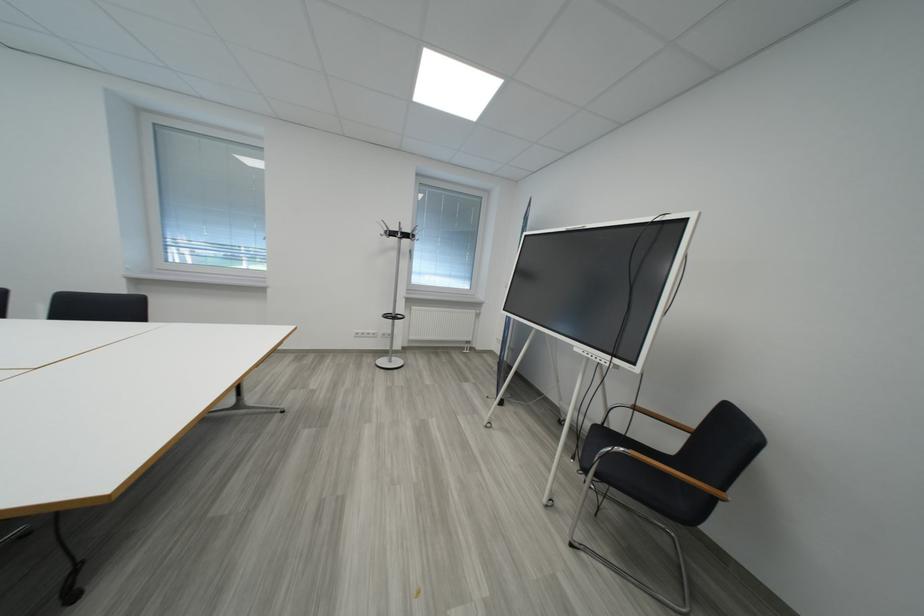
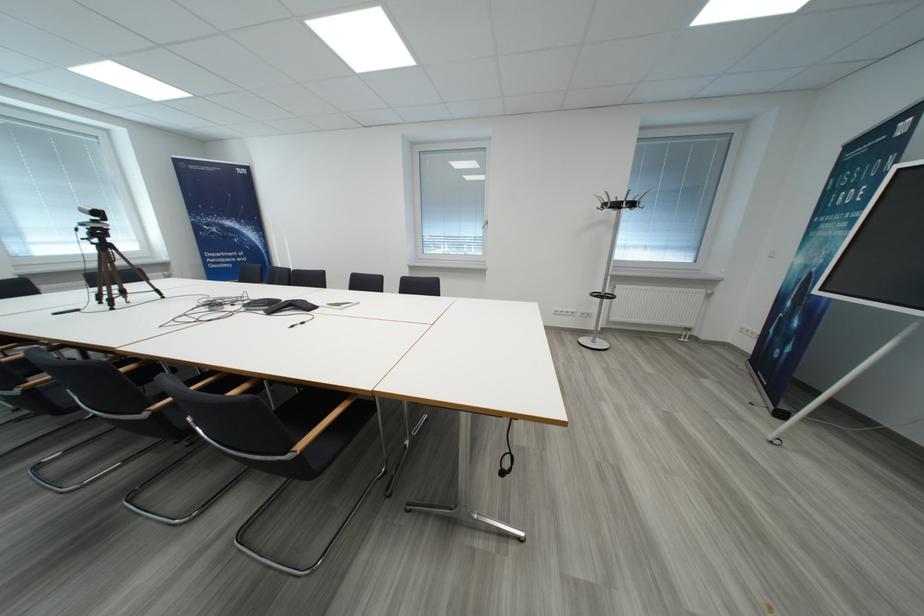
The point at [399,237] is marked in the first image. Where is the corresponding point in the second image?

(623, 208)